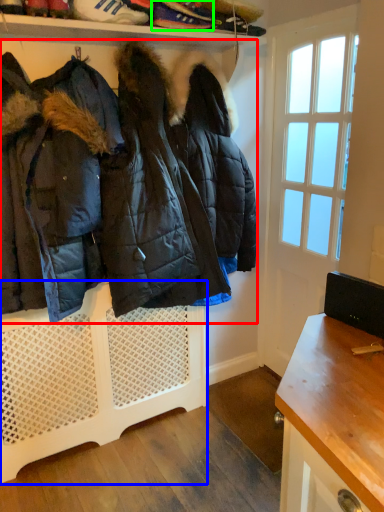
Question: Estimate the real-world distances between objects in this image. Which object is farther from jacket (highlighted by a red box), shelf (highlighted by a blue box) or footwear (highlighted by a green box)?

Choices:
 (A) shelf
 (B) footwear

Answer: (B)